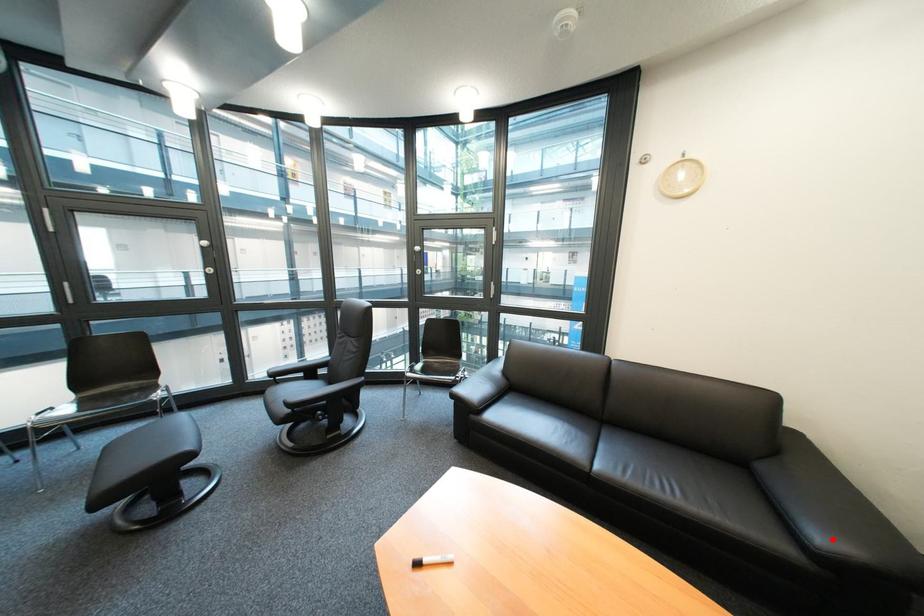
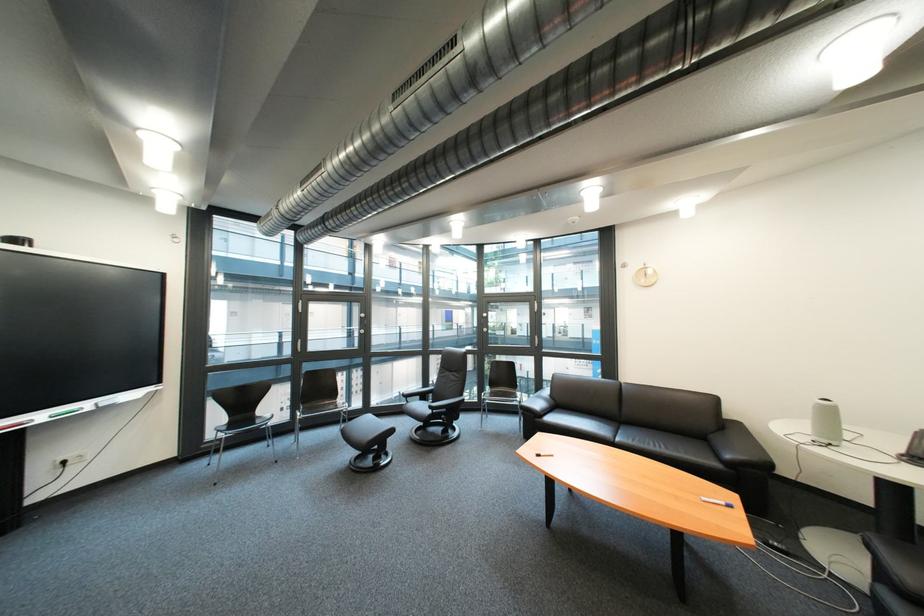
Locate, in the second image, the point that corresponds to the highlighted location in the first image.

(742, 458)